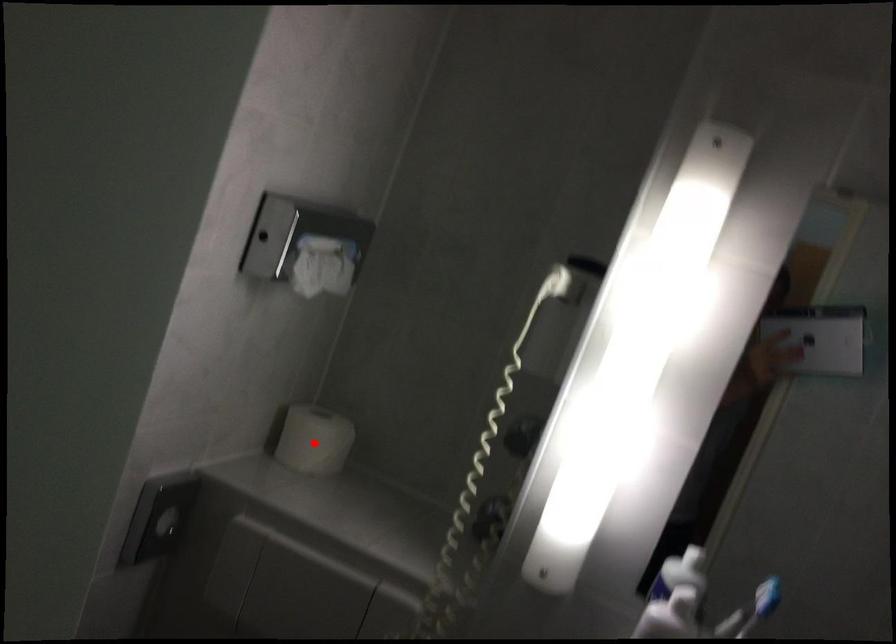
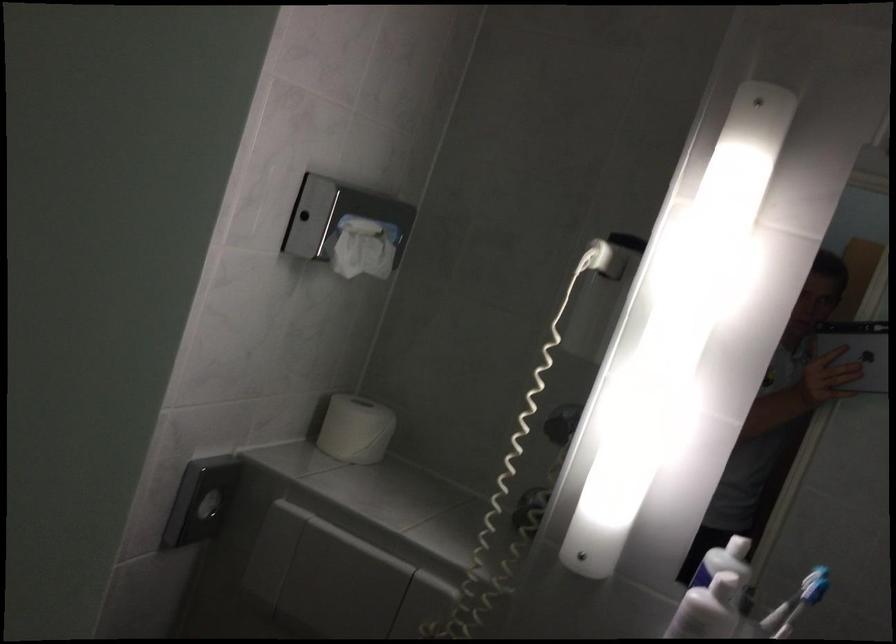
Find the pixel in the second image that matches the highlighted location in the first image.

(355, 429)